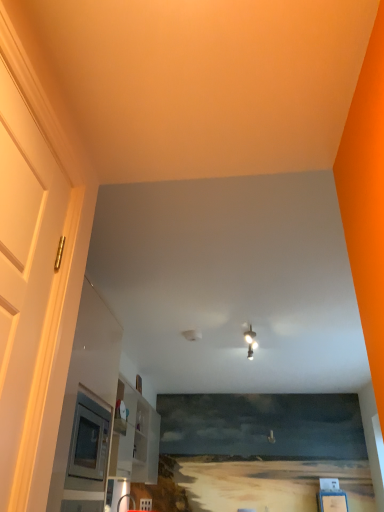
Describe the element at coordinates (25, 283) in the screenshot. Image resolution: width=384 pixels, height=512 pixels. I see `white glossy door at left` at that location.

What is the approximate width of white glossy door at left?

It is 2.62 inches.

Image resolution: width=384 pixels, height=512 pixels. In order to click on white glossy door at left in this screenshot , I will do `click(25, 283)`.

Describe the element at coordinates (250, 342) in the screenshot. I see `white glossy light fixture at center` at that location.

Locate an element on the screen. The image size is (384, 512). white glossy light fixture at center is located at coordinates (250, 342).

Locate an element on the screen. This screenshot has width=384, height=512. white glossy door at left is located at coordinates (25, 283).

Which object is positioned more to the right, white glossy door at left or white glossy light fixture at center?

Positioned to the right is white glossy light fixture at center.

Does white glossy door at left lie in front of white glossy light fixture at center?

Yes, white glossy door at left is in front of white glossy light fixture at center.

Which is closer, (14,501) or (248,343)?

The point (14,501) is more forward.

From the image's perspective, is white glossy door at left on white glossy light fixture at center?

Yes, from the image's perspective, white glossy door at left is above white glossy light fixture at center.

From a real-world perspective, who is located higher, white glossy door at left or white glossy light fixture at center?

white glossy light fixture at center is physically above.

Does white glossy door at left have a greater width compared to white glossy light fixture at center?

No.

Considering the sizes of objects white glossy door at left and white glossy light fixture at center in the image provided, who is shorter, white glossy door at left or white glossy light fixture at center?

white glossy light fixture at center.

Considering the relative sizes of white glossy door at left and white glossy light fixture at center in the image provided, is white glossy door at left bigger than white glossy light fixture at center?

Yes, white glossy door at left is bigger than white glossy light fixture at center.

Would you say white glossy door at left contains white glossy light fixture at center?

No, white glossy light fixture at center is located outside of white glossy door at left.

Is white glossy door at left in contact with white glossy light fixture at center?

No, white glossy door at left is not making contact with white glossy light fixture at center.

Is white glossy door at left turned away from white glossy light fixture at center?

No.

Can you tell me how much white glossy door at left and white glossy light fixture at center differ in facing direction?

They differ by 86.7 degrees in their facing directions.

Locate an element on the screen. The width and height of the screenshot is (384, 512). light fixture above the white glossy door at left (from a real-world perspective) is located at coordinates (250, 342).

Would you say white glossy light fixture at center is to the left or to the right of white glossy door at left in the picture?

Clearly, white glossy light fixture at center is on the right of white glossy door at left in the image.

Does white glossy light fixture at center lie behind white glossy door at left?

Yes, white glossy light fixture at center is further from the viewer.

Is point (250, 330) closer or farther from the camera than point (7, 450)?

Point (250, 330).

From the image's perspective, is white glossy light fixture at center on top of white glossy door at left?

Actually, white glossy light fixture at center appears below white glossy door at left in the image.

From a real-world perspective, is white glossy light fixture at center located beneath white glossy door at left?

No, from a real-world perspective, white glossy light fixture at center is not under white glossy door at left.

Considering the sizes of white glossy light fixture at center and white glossy door at left in the image, is white glossy light fixture at center wider or thinner than white glossy door at left?

Clearly, white glossy light fixture at center has more width compared to white glossy door at left.

In terms of height, does white glossy light fixture at center look taller or shorter compared to white glossy door at left?

In the image, white glossy light fixture at center appears to be shorter than white glossy door at left.

Between white glossy light fixture at center and white glossy door at left, which one has larger size?

With larger size is white glossy door at left.

Choose the correct answer: Is white glossy light fixture at center inside white glossy door at left or outside it?

white glossy light fixture at center is spatially situated outside white glossy door at left.

Would you consider white glossy light fixture at center to be distant from white glossy door at left?

Yes.

Is white glossy light fixture at center facing towards white glossy door at left?

Yes, white glossy light fixture at center is oriented towards white glossy door at left.

How many degrees apart are the facing directions of white glossy light fixture at center and white glossy door at left?

They differ by 86.7 degrees in their facing directions.

How distant is white glossy light fixture at center from white glossy door at left?

white glossy light fixture at center is 8.43 feet from white glossy door at left.

Find the location of `door in front of the white glossy light fixture at center`. door in front of the white glossy light fixture at center is located at coordinates (25, 283).

At what (x,y) coordinates should I click in order to perform the action: click on light fixture above the white glossy door at left (from a real-world perspective). Please return your answer as a coordinate pair (x, y). Looking at the image, I should click on (250, 342).

Locate an element on the screen. The image size is (384, 512). door on the left of white glossy light fixture at center is located at coordinates (25, 283).